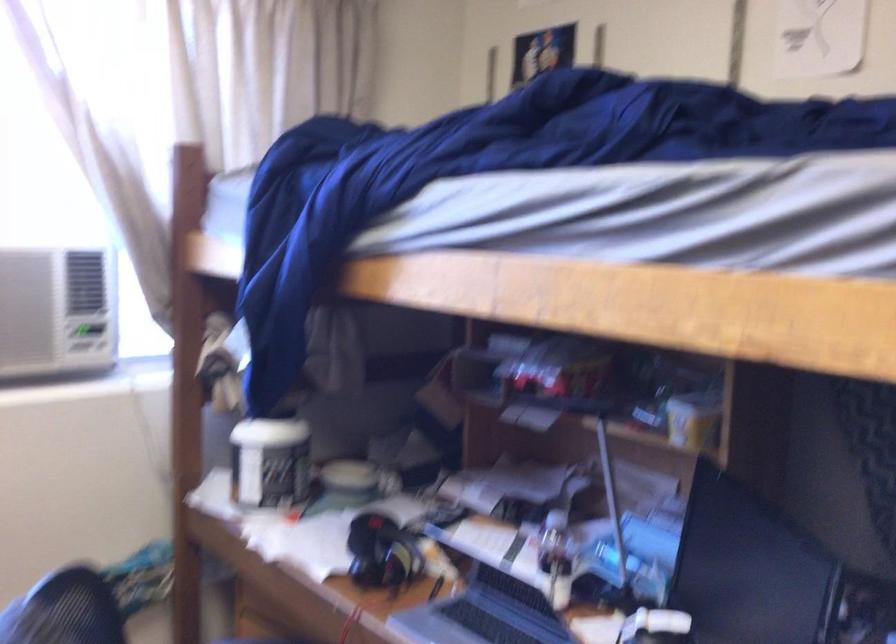
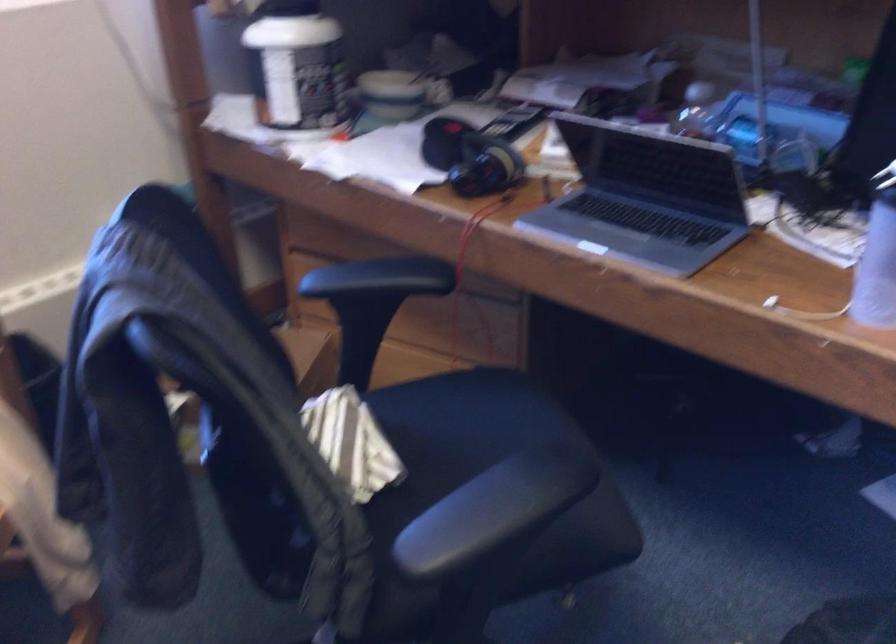
The images are taken continuously from a first-person perspective. In which direction are you moving?

The movement direction of the cameraman is left, forward.